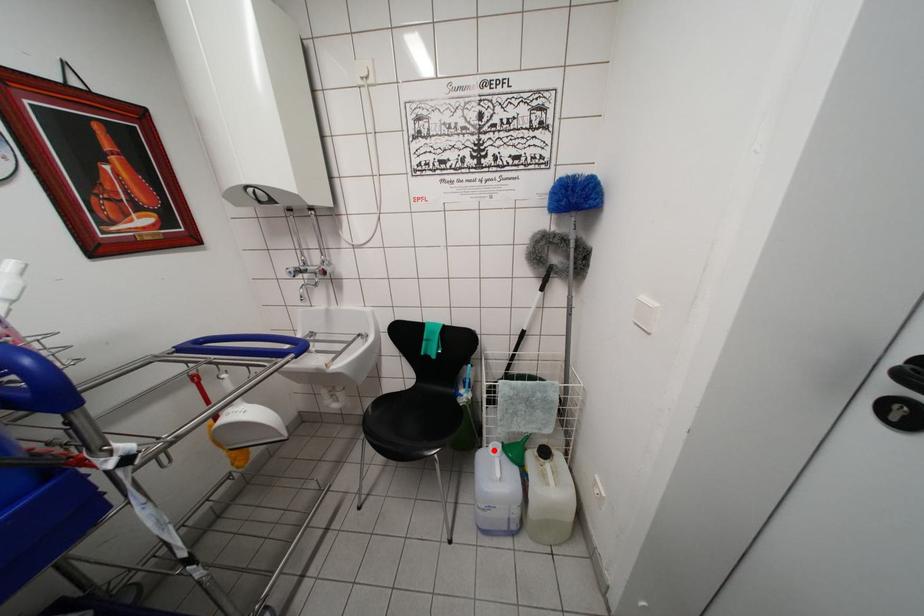
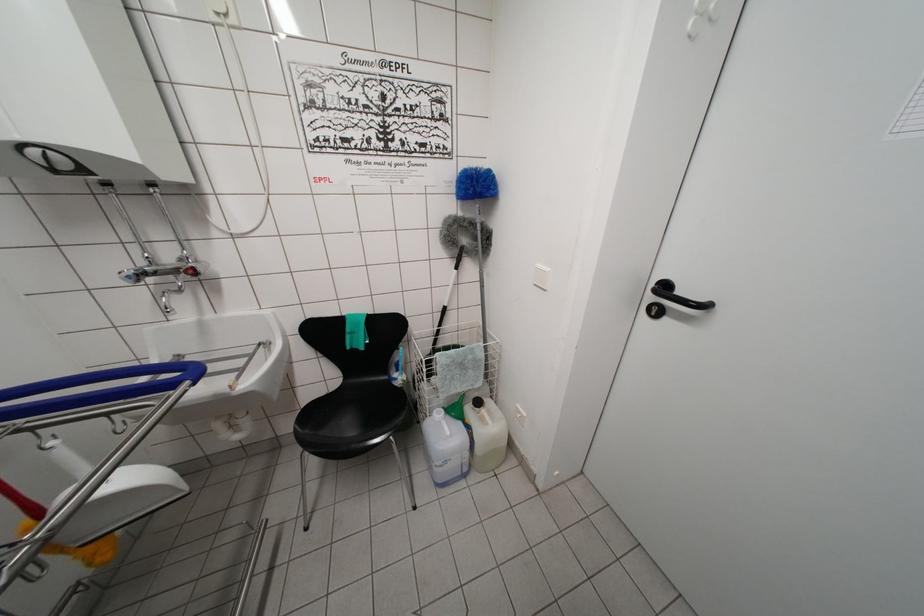
Question: I am providing you with two images of the same scene from different viewpoints. In image1, a red point is highlighted. Considering the same 3D point in image2, which of the following is correct?

Choices:
 (A) It is closer
 (B) It is farther

Answer: (B)